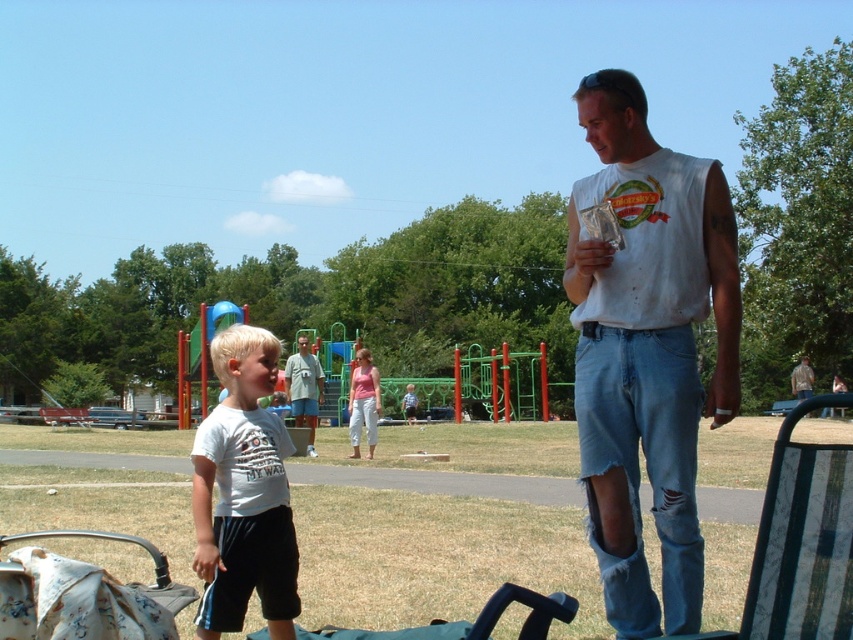
Question: Which of the following is the farthest from the observer?

Choices:
 (A) (302, 408)
 (B) (413, 627)
 (C) (257, 404)

Answer: (A)

Question: Does white cotton tank top at center have a lesser width compared to white fabric baby carriage at lower left?

Choices:
 (A) no
 (B) yes

Answer: (B)

Question: Which of the following is the closest to the observer?

Choices:
 (A) white matte t-shirt at lower left
 (B) light blue jeans at center
 (C) white cotton tank top at center
 (D) white fabric baby carriage at lower left

Answer: (C)

Question: Can you confirm if white cotton tank top at center is positioned to the right of white matte t-shirt at lower left?

Choices:
 (A) yes
 (B) no

Answer: (A)

Question: Which point is farther from the camera taking this photo?

Choices:
 (A) (601, 273)
 (B) (299, 381)
 (C) (260, 563)

Answer: (B)

Question: Considering the relative positions of white cotton tank top at center and white matte t-shirt at lower left in the image provided, where is white cotton tank top at center located with respect to white matte t-shirt at lower left?

Choices:
 (A) above
 (B) below

Answer: (A)